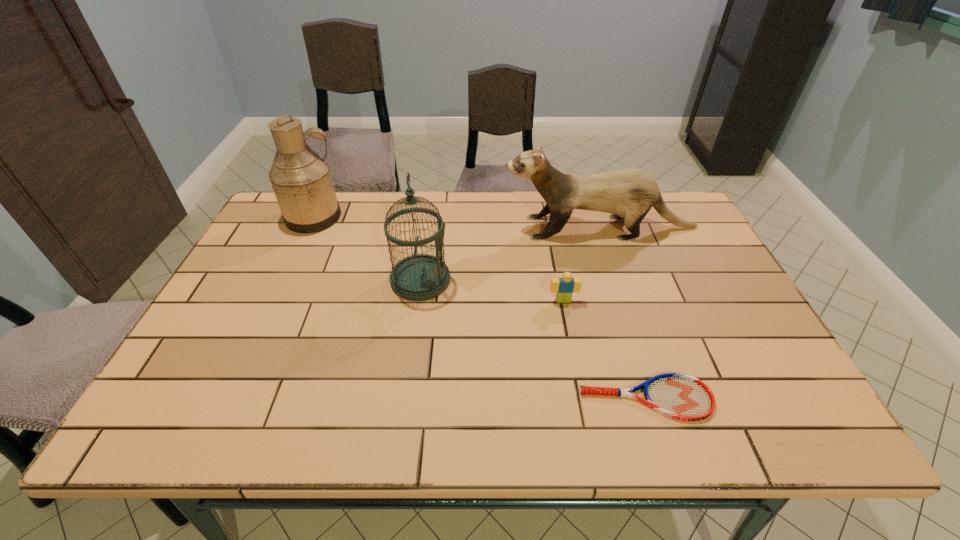
The image size is (960, 540). Identify the location of the leftmost object. (301, 179).

The image size is (960, 540). Identify the location of the second object from left to right. (419, 277).

The image size is (960, 540). What are the coordinates of `ferret` in the screenshot? It's located at (630, 193).

The height and width of the screenshot is (540, 960). I want to click on the second shortest object, so click(x=563, y=287).

The height and width of the screenshot is (540, 960). In order to click on tennis racket in this screenshot , I will do `click(679, 396)`.

I want to click on the shortest object, so click(x=679, y=396).

At what (x,y) coordinates should I click in order to perform the action: click on vacant space located on the right of the pitcher. Please return your answer as a coordinate pair (x, y). The height and width of the screenshot is (540, 960). Looking at the image, I should click on (384, 218).

Image resolution: width=960 pixels, height=540 pixels. I want to click on vacant space located on the front-facing side of the birdcage, so click(x=476, y=280).

Locate an element on the screen. The height and width of the screenshot is (540, 960). free location located 0.190m on the face of the third tallest object is located at coordinates (442, 228).

Where is `free space located 0.230m on the face of the third tallest object`? The width and height of the screenshot is (960, 540). free space located 0.230m on the face of the third tallest object is located at coordinates (428, 228).